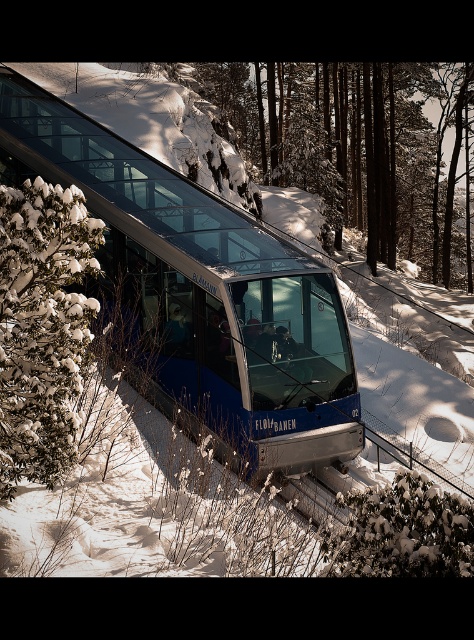
Which is behind, point (215, 291) or point (410, 256)?

The point (410, 256) is more distant.

Which is more to the left, metallic blue train at center or snow-covered evergreen tree at center?

metallic blue train at center

Does point (173, 244) come in front of point (275, 161)?

That is True.

Find the location of a particular element. This screenshot has height=640, width=474. metallic blue train at center is located at coordinates (201, 291).

Is metallic blue train at center closer to camera compared to green textured pine tree at left?

No, it is behind green textured pine tree at left.

Can you confirm if metallic blue train at center is positioned above green textured pine tree at left?

Correct, metallic blue train at center is located above green textured pine tree at left.

Is point (227, 365) positioned before point (7, 260)?

No, (227, 365) is further to viewer.

The width and height of the screenshot is (474, 640). I want to click on metallic blue train at center, so click(201, 291).

Who is more forward, (346, 193) or (40, 384)?

Point (40, 384) is more forward.

This screenshot has height=640, width=474. Identify the location of snow-covered evergreen tree at center. [355, 147].

Image resolution: width=474 pixels, height=640 pixels. Describe the element at coordinates (355, 147) in the screenshot. I see `snow-covered evergreen tree at center` at that location.

Find the location of a particular element. Image resolution: width=474 pixels, height=640 pixels. snow-covered evergreen tree at center is located at coordinates (355, 147).